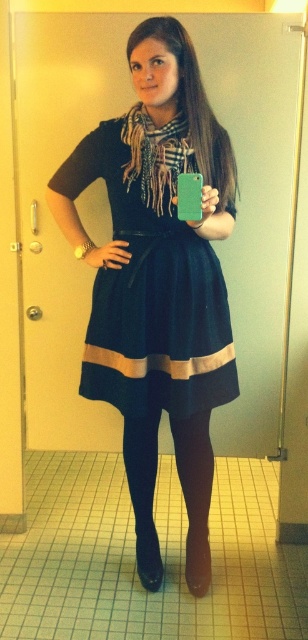
Question: Does navy velvet dress at center come in front of plaid wool scarf at center?

Choices:
 (A) no
 (B) yes

Answer: (A)

Question: From the image, what is the correct spatial relationship of navy velvet dress at center in relation to plaid wool scarf at center?

Choices:
 (A) above
 (B) below

Answer: (B)

Question: Which point is farther to the camera?

Choices:
 (A) black smooth tights at center
 (B) navy velvet dress at center

Answer: (A)

Question: Which of the following is the closest to the observer?

Choices:
 (A) (170, 196)
 (B) (199, 572)
 (C) (101, 145)

Answer: (A)

Question: Does black smooth tights at center come in front of plaid wool scarf at center?

Choices:
 (A) no
 (B) yes

Answer: (A)

Question: Which of the following is the closest to the observer?

Choices:
 (A) navy velvet dress at center
 (B) plaid wool scarf at center
 (C) black smooth tights at center

Answer: (B)